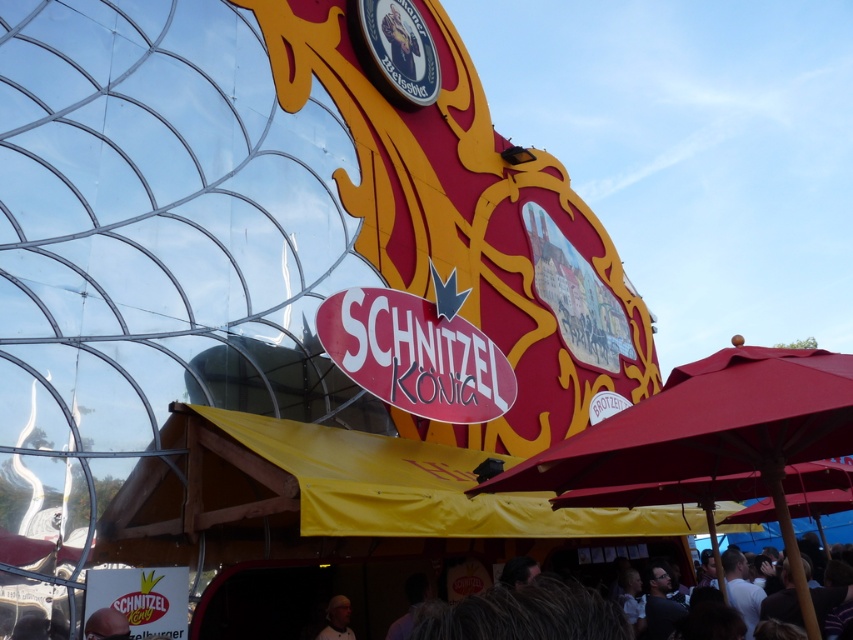
Question: Which point is farther to the camera?

Choices:
 (A) matte red umbrella at lower right
 (B) white matte hair at lower center

Answer: (B)

Question: From the image, what is the correct spatial relationship of matte red umbrella at lower right in relation to matte black helmet at lower left?

Choices:
 (A) below
 (B) above

Answer: (B)

Question: Can you confirm if matte red umbrella at lower right is bigger than white matte hair at lower center?

Choices:
 (A) yes
 (B) no

Answer: (B)

Question: Which object is farther from the camera taking this photo?

Choices:
 (A) matte black helmet at lower left
 (B) matte red umbrella at lower right
 (C) white matte hair at lower center

Answer: (C)

Question: Is matte black helmet at lower left to the left of white matte hair at lower center from the viewer's perspective?

Choices:
 (A) yes
 (B) no

Answer: (A)

Question: Which point is farther from the camera taking this photo?

Choices:
 (A) (666, 449)
 (B) (108, 621)

Answer: (B)